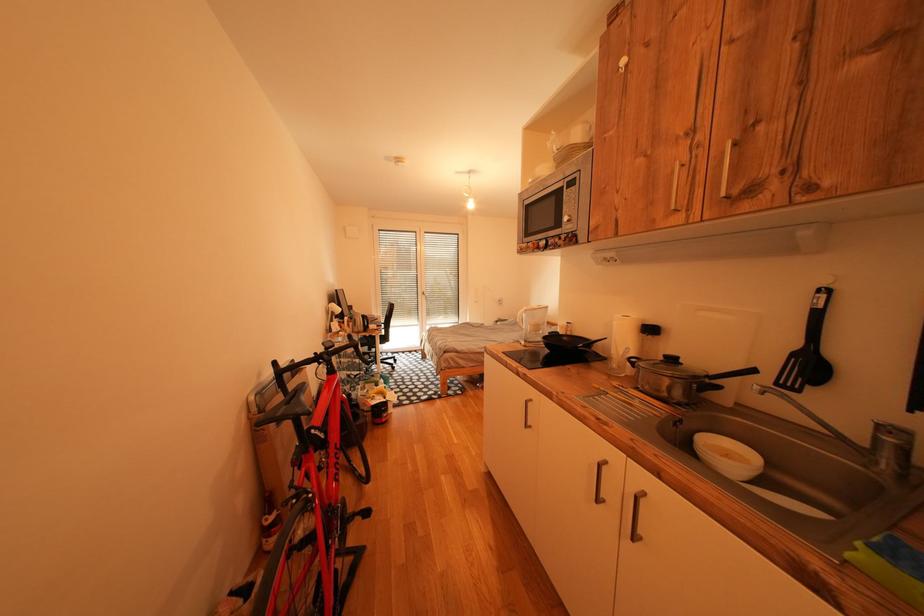
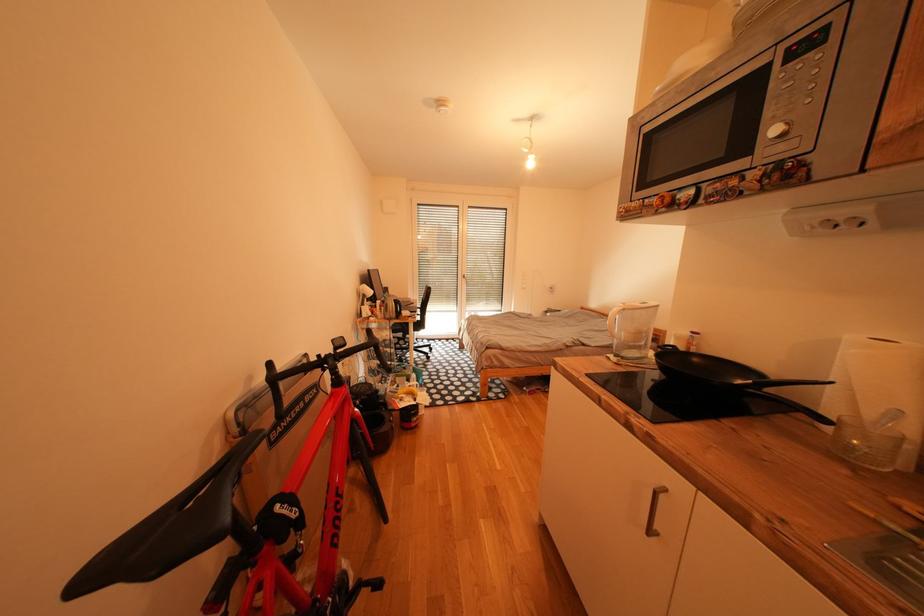
Question: The images are taken continuously from a first-person perspective. In which direction are you moving?

Choices:
 (A) Left
 (B) Right
 (C) Forward
 (D) Backward

Answer: (C)